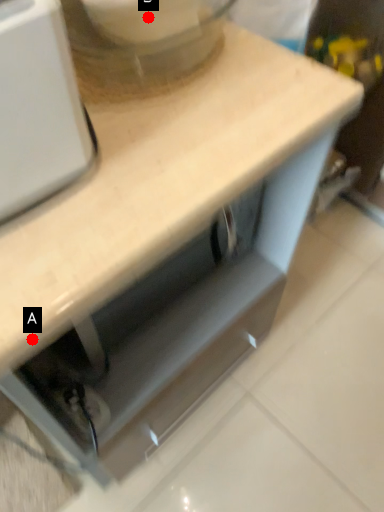
Question: Two points are circled on the image, labeled by A and B beside each circle. Which of the following is the closest to the observer?

Choices:
 (A) A is closer
 (B) B is closer

Answer: (A)